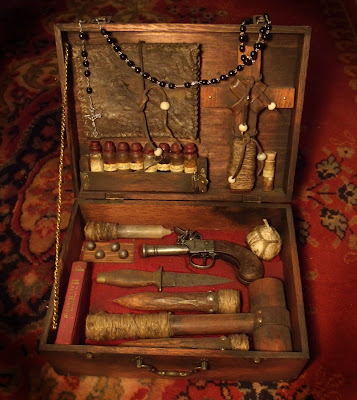
The image size is (357, 400). Identify the location of carpet. (324, 123).